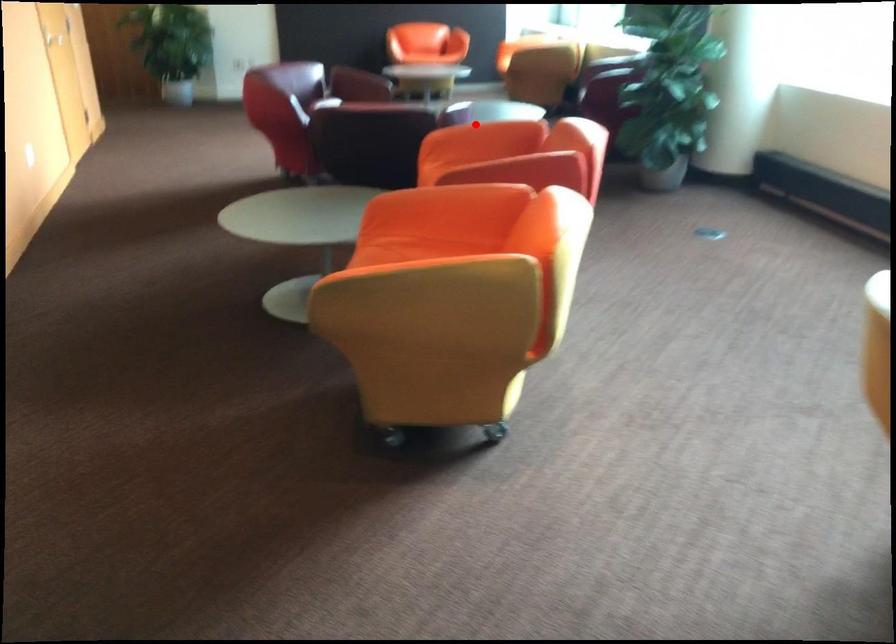
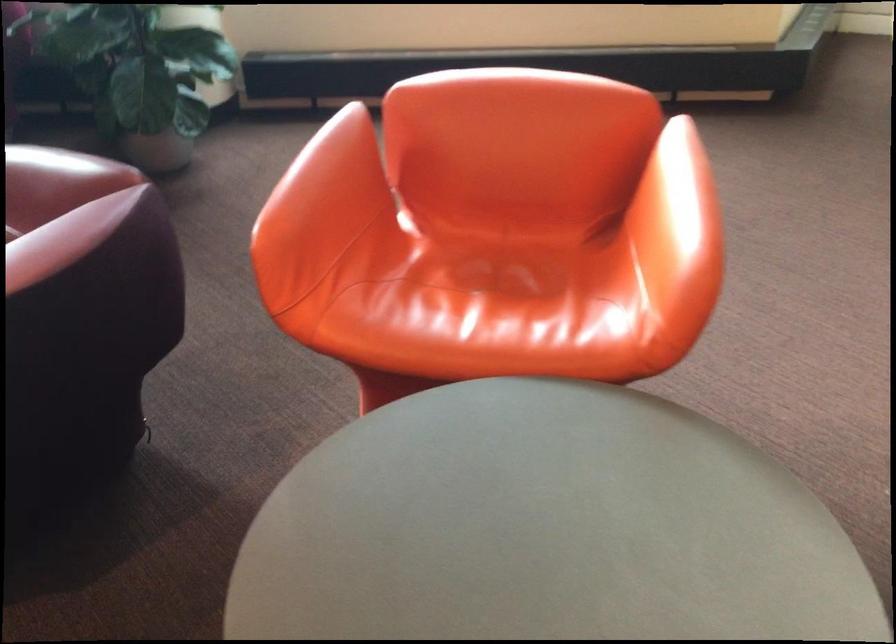
Locate, in the second image, the point that corresponds to the highlighted location in the first image.

(321, 192)